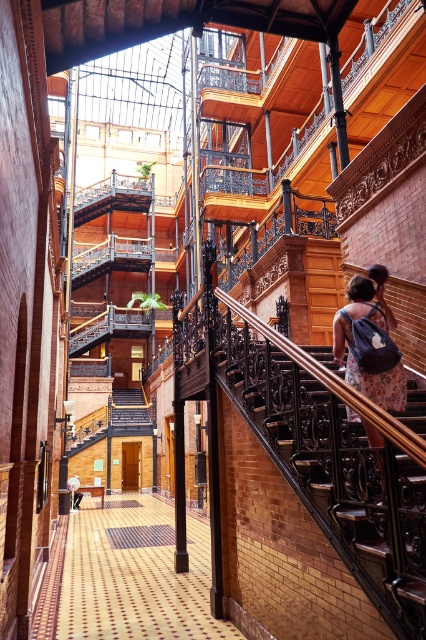
You are standing at the entrance of the grand building and want to reach the polished brass stair at center. According to the coordinates given, where should you head to locate it?

The polished brass stair at center is located at coordinates point (336, 474), so you should head towards that coordinate point to locate it.

You are standing at the lower left corner of the atrium and see the polished brass stair at center and the light brown leather backpack at lower left. Which object is positioned higher in the image?

The polished brass stair at center is located above the light brown leather backpack at lower left, so the polished brass stair at center is higher in the image.

Based on the photo, you are a photographer standing at the camera position. You want to take a photo of the polished brass stair at center. Can you fit the entire stair into your camera frame if your camera has a maximum horizontal field of view of 4 meters?

The distance between the polished brass stair at center and the camera is 4.14 meters, which is slightly beyond the camera frame with a maximum horizontal field of view of 4 meters. Therefore, the entire stair cannot be captured in one frame.